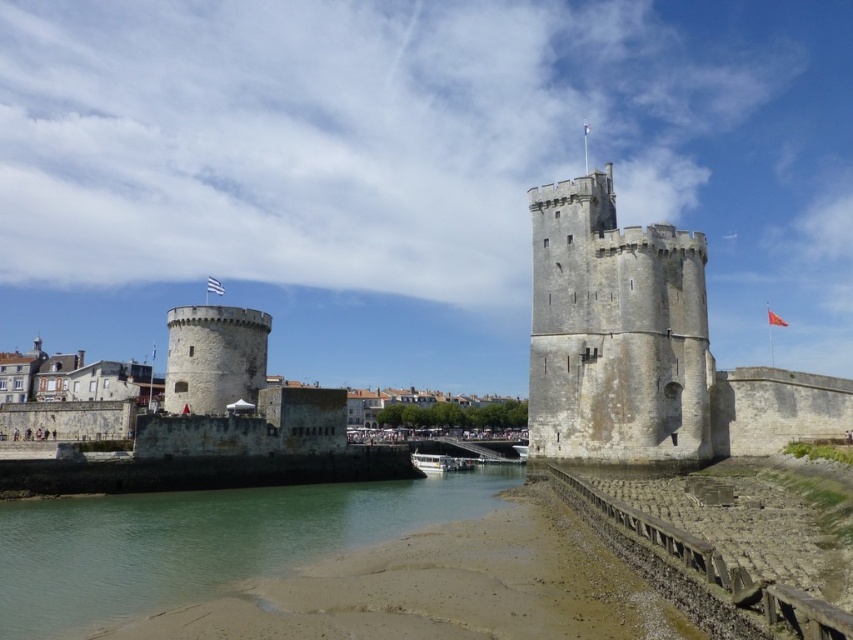
Between gray stone tower at center and red fabric flag at upper center, which one appears on the left side from the viewer's perspective?

Positioned to the left is gray stone tower at center.

Who is more forward, [561,440] or [775,317]?

Point [561,440]

Between point (695, 333) and point (775, 323), which one is positioned behind?

Positioned behind is point (775, 323).

You are a GUI agent. You are given a task and a screenshot of the screen. Output one action in this format:
    pyautogui.click(x=<x>, y=<y>)
    Task: Click on the gray stone tower at center
    The height and width of the screenshot is (640, 853).
    Given the screenshot: What is the action you would take?
    point(614,332)

Can you confirm if green sand at lower left is positioned to the right of gray stone tower at center?

Incorrect, green sand at lower left is not on the right side of gray stone tower at center.

Which of these two, green sand at lower left or gray stone tower at center, stands shorter?

green sand at lower left

Is point (36, 518) in front of point (585, 339)?

Yes, point (36, 518) is in front of point (585, 339).

At what (x,y) coordinates should I click in order to perform the action: click on green sand at lower left. Please return your answer as a coordinate pair (x, y). The image size is (853, 640). Looking at the image, I should click on (200, 541).

Can you confirm if gray stone tower at center is shorter than white fabric flag at center?

In fact, gray stone tower at center may be taller than white fabric flag at center.

Is gray stone tower at center wider than white fabric flag at center?

Indeed, gray stone tower at center has a greater width compared to white fabric flag at center.

Does point (708, 452) lie in front of point (213, 291)?

That is True.

Locate an element on the screen. The height and width of the screenshot is (640, 853). gray stone tower at center is located at coordinates (614, 332).